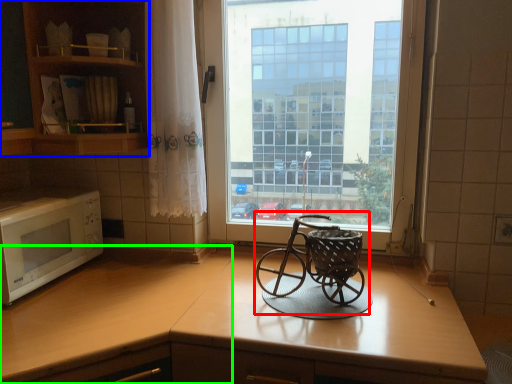
Question: Based on their relative distances, which object is nearer to baby carriage (highlighted by a red box)? Choose from cabinetry (highlighted by a blue box) and counter top (highlighted by a green box).

Choices:
 (A) cabinetry
 (B) counter top

Answer: (B)